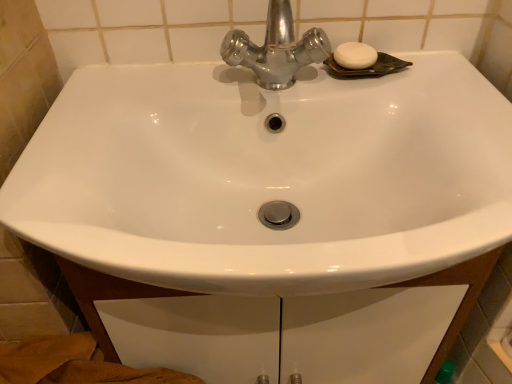
Question: Could white matte soap at upper right be considered to be inside shiny metallic faucet at upper center?

Choices:
 (A) no
 (B) yes

Answer: (A)

Question: Is shiny metallic faucet at upper center outside white matte soap at upper right?

Choices:
 (A) no
 (B) yes

Answer: (B)

Question: Can you confirm if shiny metallic faucet at upper center is taller than white matte soap at upper right?

Choices:
 (A) yes
 (B) no

Answer: (A)

Question: Does shiny metallic faucet at upper center have a lesser height compared to white matte soap at upper right?

Choices:
 (A) yes
 (B) no

Answer: (B)

Question: From the image's perspective, would you say shiny metallic faucet at upper center is positioned over white matte soap at upper right?

Choices:
 (A) no
 (B) yes

Answer: (A)

Question: From the image's perspective, is shiny metallic faucet at upper center below white matte soap at upper right?

Choices:
 (A) no
 (B) yes

Answer: (B)

Question: Is white matte soap at upper right shorter than shiny metallic faucet at upper center?

Choices:
 (A) yes
 (B) no

Answer: (A)

Question: From a real-world perspective, is white matte soap at upper right over shiny metallic faucet at upper center?

Choices:
 (A) no
 (B) yes

Answer: (A)

Question: Is white matte soap at upper right in contact with shiny metallic faucet at upper center?

Choices:
 (A) yes
 (B) no

Answer: (B)

Question: From the image's perspective, is white matte soap at upper right located above shiny metallic faucet at upper center?

Choices:
 (A) yes
 (B) no

Answer: (A)

Question: From a real-world perspective, is white matte soap at upper right beneath shiny metallic faucet at upper center?

Choices:
 (A) yes
 (B) no

Answer: (A)

Question: Considering the relative sizes of white matte soap at upper right and shiny metallic faucet at upper center in the image provided, is white matte soap at upper right taller than shiny metallic faucet at upper center?

Choices:
 (A) no
 (B) yes

Answer: (A)

Question: Do you think shiny metallic faucet at upper center is within white matte soap at upper right, or outside of it?

Choices:
 (A) outside
 (B) inside

Answer: (A)